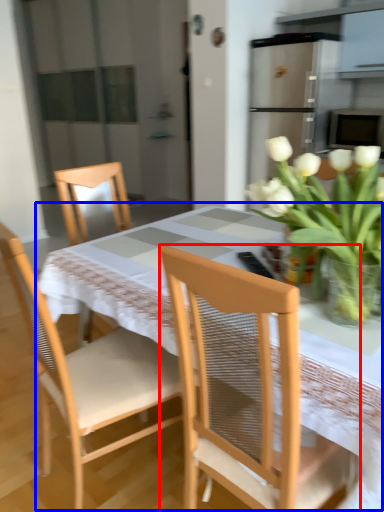
Question: Which point is further to the camera, chair (highlighted by a red box) or kitchen & dining room table (highlighted by a blue box)?

Choices:
 (A) chair
 (B) kitchen & dining room table

Answer: (B)